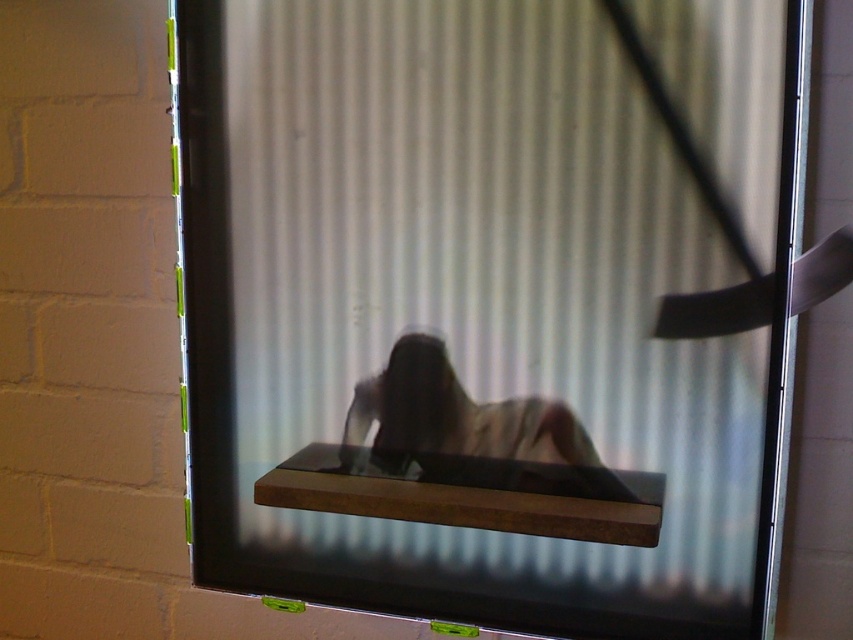
You are standing in front of the mirror and notice an object labeled as brown wood at center. Can you determine the exact coordinates where this object is located?

The brown wood at center is located at point (473, 493).

You are an interior designer assessing the layout of a room with a mirror on the wall. You notice a brown wood at center and a light beige fabric at center. According to the spatial arrangement, which object is positioned to the left of the other?

The brown wood at center is to the left of the light beige fabric at center.